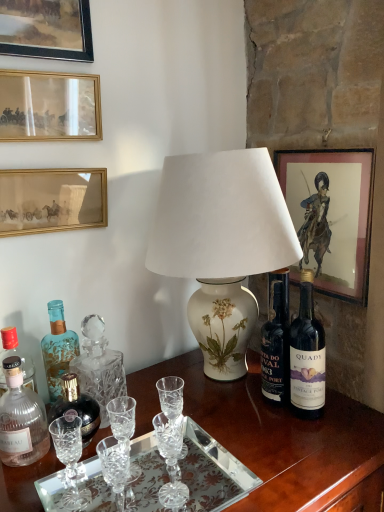
At what (x,y) coordinates should I click in order to perform the action: click on vacant space in front of blue glass bottle at left, the first bottle positioned from the back. Please return your answer as a coordinate pair (x, y). Looking at the image, I should click on (50, 462).